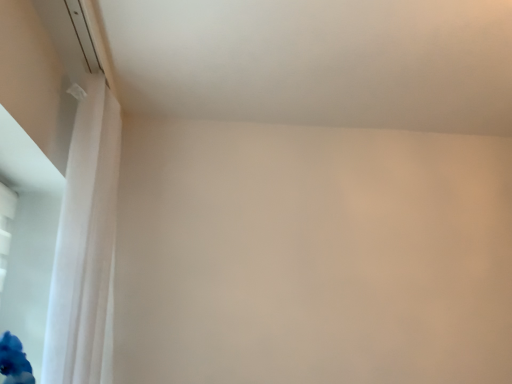
Question: Is point (86, 140) positioned closer to the camera than point (0, 160)?

Choices:
 (A) closer
 (B) farther

Answer: (A)

Question: Considering the positions of white sheer curtain at left and transparent plastic window screen at lower left in the image, is white sheer curtain at left taller or shorter than transparent plastic window screen at lower left?

Choices:
 (A) tall
 (B) short

Answer: (A)

Question: Relative to transparent plastic window screen at lower left, is white sheer curtain at left in front or behind?

Choices:
 (A) front
 (B) behind

Answer: (A)

Question: Is transparent plastic window screen at lower left to the left or to the right of white sheer curtain at left in the image?

Choices:
 (A) left
 (B) right

Answer: (A)

Question: From the image's perspective, relative to white sheer curtain at left, is transparent plastic window screen at lower left above or below?

Choices:
 (A) above
 (B) below

Answer: (B)

Question: From a real-world perspective, relative to white sheer curtain at left, is transparent plastic window screen at lower left vertically above or below?

Choices:
 (A) above
 (B) below

Answer: (B)

Question: From their relative heights in the image, would you say transparent plastic window screen at lower left is taller or shorter than white sheer curtain at left?

Choices:
 (A) short
 (B) tall

Answer: (A)